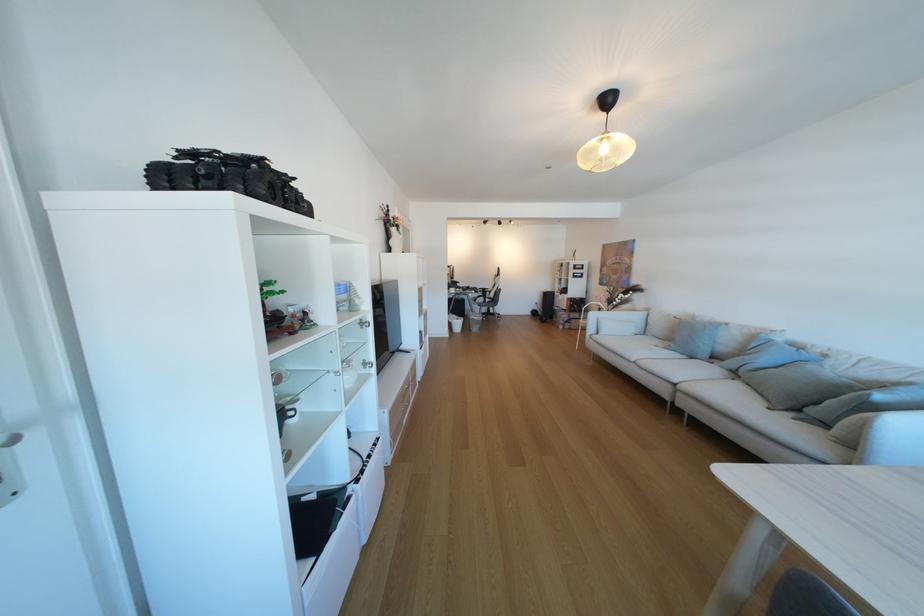
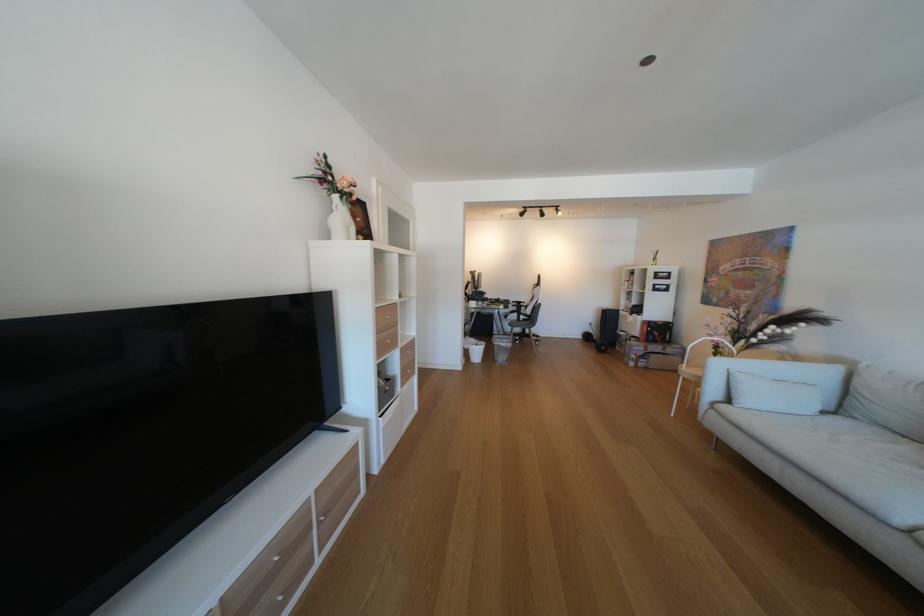
Find the pixel in the second image that matches [481,322] in the first image.

(506, 349)